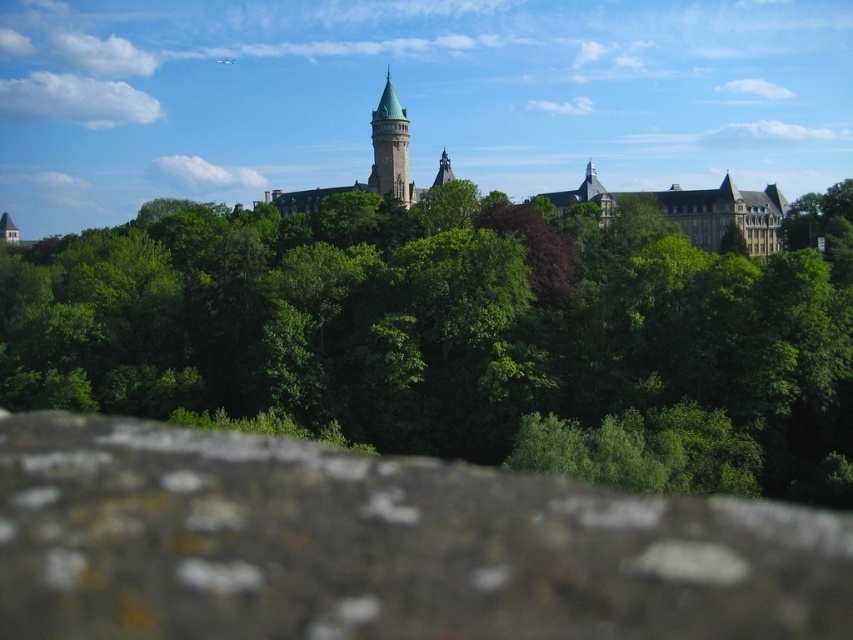
In the scene shown: You are an architect analyzing the structure of the scene. You need to determine which object occupies more space in the image between the brown rough stone at lower center and the green stone tower at center. Based on the provided information, which one is larger?

The brown rough stone at lower center is larger in size than the green stone tower at center, so it occupies more space in the image.

You are a photographer trying to capture the green leafy tree at center and the green stone tower at center in a single frame. Based on their sizes, which object would appear more prominent in the photo?

The green leafy tree at center appears more prominent in the photo because it is larger in size than the green stone tower at center.

You are standing in front of a historic building with a stone wall nearby. You want to take a photo that includes both the brown rough stone at lower center and the historic building in the background. Given that your camera has a maximum focus range of 65 meters, will you be able to capture both in focus at the same time?

The brown rough stone at lower center is 64.91 meters from the viewer. Since the camera can focus up to 65 meters, both the stone and the building behind it can be in focus simultaneously.